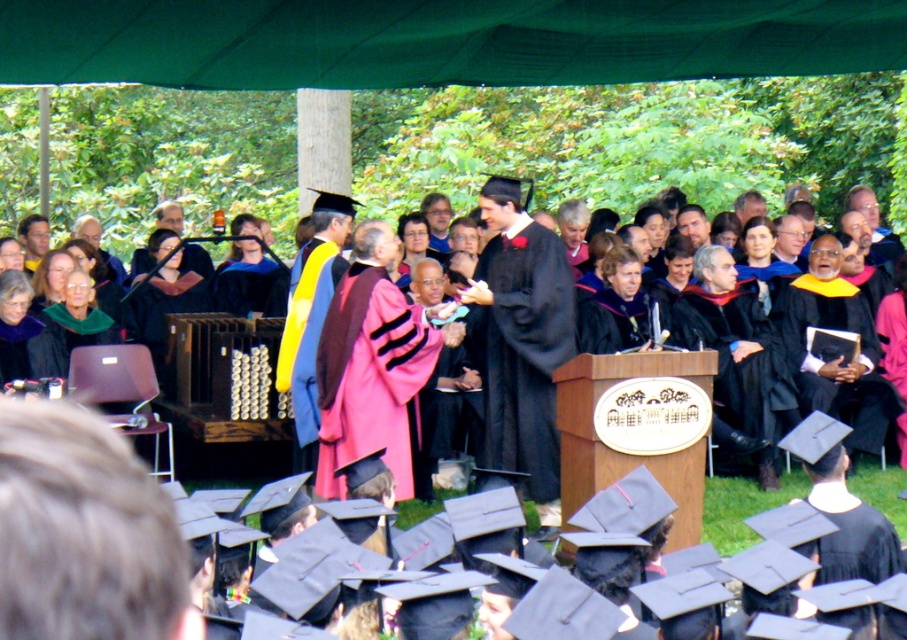
You are a photographer at the graduation ceremony. You need to capture a photo of both the pink velvet gown at center and the matte black graduation gown at center. Which gown should you focus on first to ensure both are in frame?

You should focus on the pink velvet gown at center first because it is positioned on the left side of the matte black graduation gown at center, so by centering the pink gown, the matte black one will naturally fall into the frame to its right.

You are a photographer at the graduation ceremony. You need to capture a photo that includes both the matte black graduation gown at center and the pink velvet robe at center. Based on their positions, which one should you adjust your camera to focus on first to ensure both are in frame?

The matte black graduation gown at center is to the right of the pink velvet robe at center. To ensure both are in frame, focus on the pink velvet robe at center first since it is on the left, then adjust the camera to include the matte black graduation gown at center on the right.

You are a photographer at the graduation ceremony. You need to capture a photo of the pink velvet gown at center and the pink velvet robe at center. Which one appears smaller in the photo?

The pink velvet gown at center has a smaller size compared to the pink velvet robe at center, so the pink velvet gown at center will appear smaller in the photo.